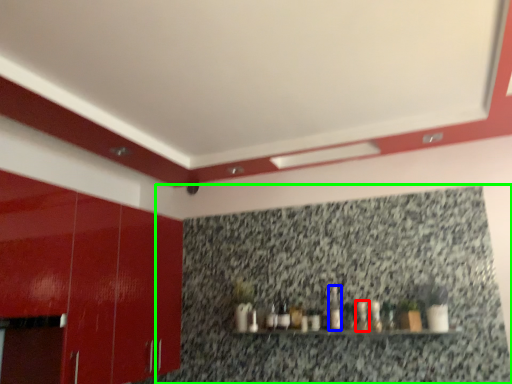
Question: Estimate the real-world distances between objects in this image. Which object is farther from bottle (highlighted by a red box), bottle (highlighted by a blue box) or granite (highlighted by a green box)?

Choices:
 (A) bottle
 (B) granite

Answer: (B)